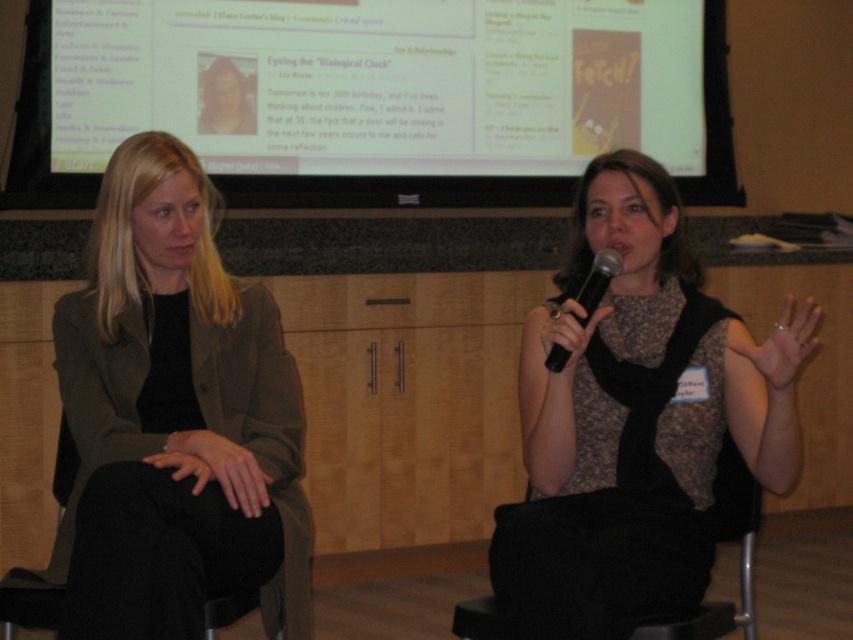
You are an event planner who needs to place a 1.2 meter wide banner on the wall behind the two people. The banner must be centered between the two individuals. Given the coordinates of the projection screen at point (375, 97), can you determine if the banner will overlap with the projection screen?

The projection screen at point (375, 97) is located at upper center. Since the banner is to be centered between the two individuals, it would align with the central area where the projection screen is placed. Therefore, the banner will overlap with the projection screen at point (375, 97).